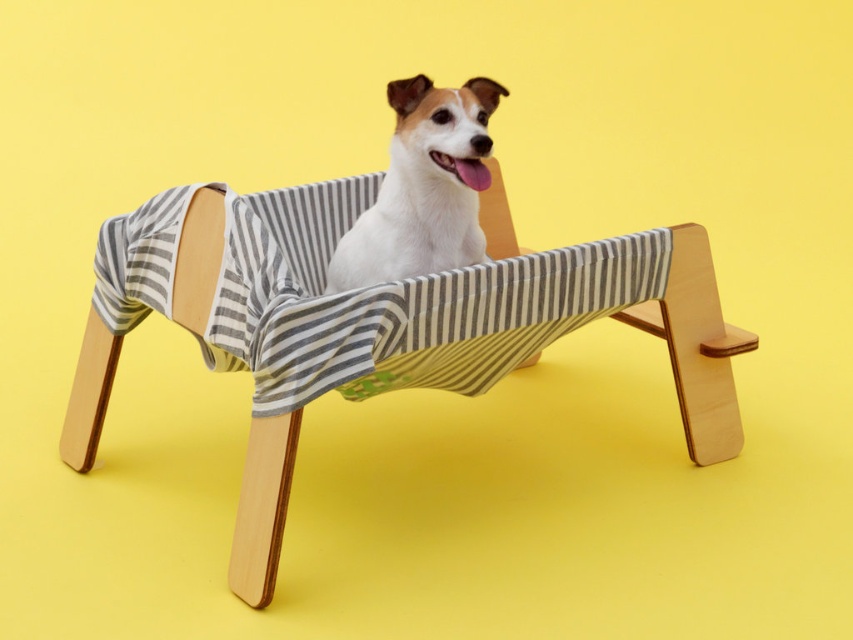
Question: Is wooden striped beach chair at center below white fabric dog bed at center?

Choices:
 (A) no
 (B) yes

Answer: (B)

Question: Among these objects, which one is nearest to the camera?

Choices:
 (A) white fabric dog bed at center
 (B) wooden striped beach chair at center

Answer: (B)

Question: Which object appears closest to the camera in this image?

Choices:
 (A) white fabric dog bed at center
 (B) wooden striped beach chair at center

Answer: (B)

Question: Which point is farther to the camera?

Choices:
 (A) (527, 360)
 (B) (410, 150)

Answer: (A)

Question: Where is wooden striped beach chair at center located in relation to white fabric dog bed at center in the image?

Choices:
 (A) above
 (B) below

Answer: (B)

Question: Is wooden striped beach chair at center further to camera compared to white fabric dog bed at center?

Choices:
 (A) no
 (B) yes

Answer: (A)